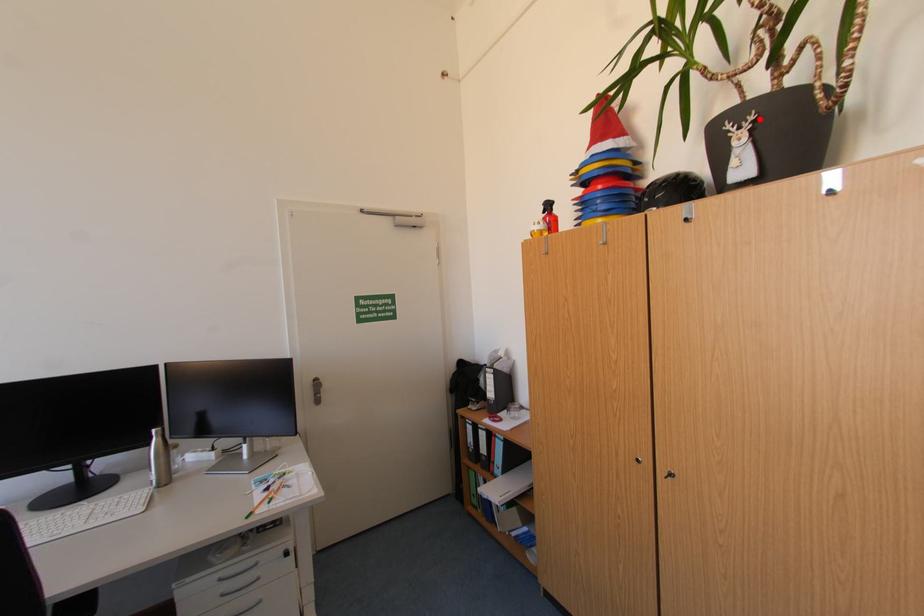
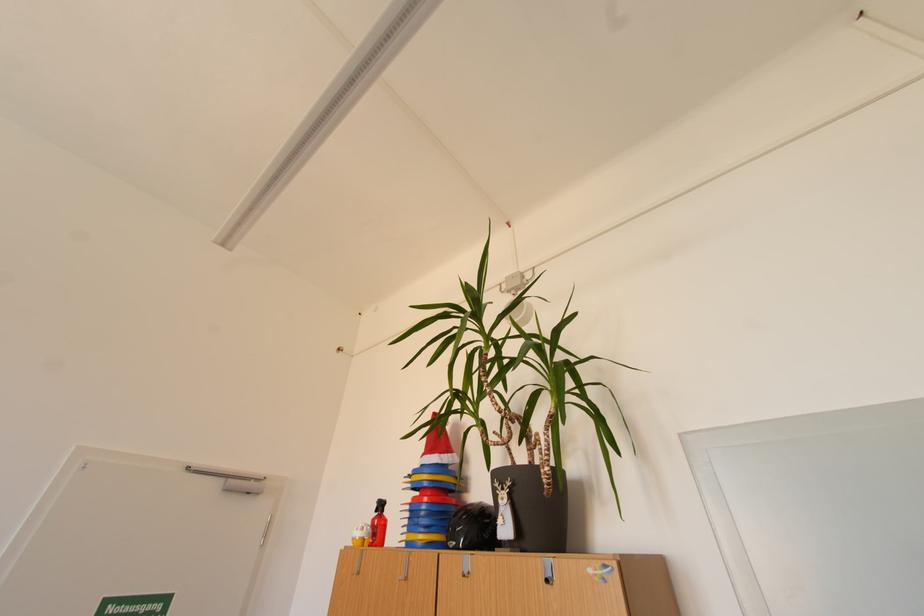
Question: I am providing you with two images of the same scene from different viewpoints. A red point is marked on the first image. At the location where the point appears in image 1, is it still visible in image 2?

Choices:
 (A) Yes
 (B) No

Answer: (A)